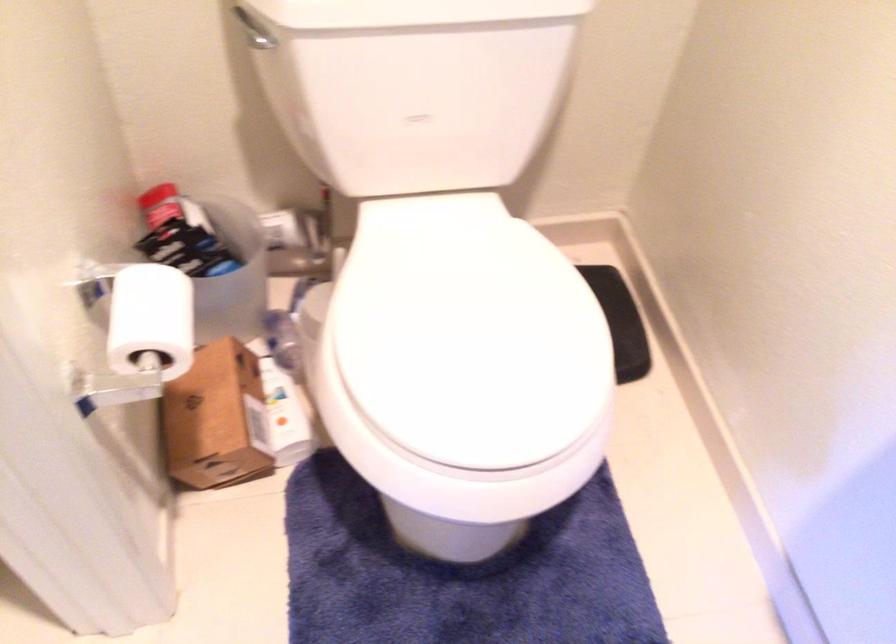
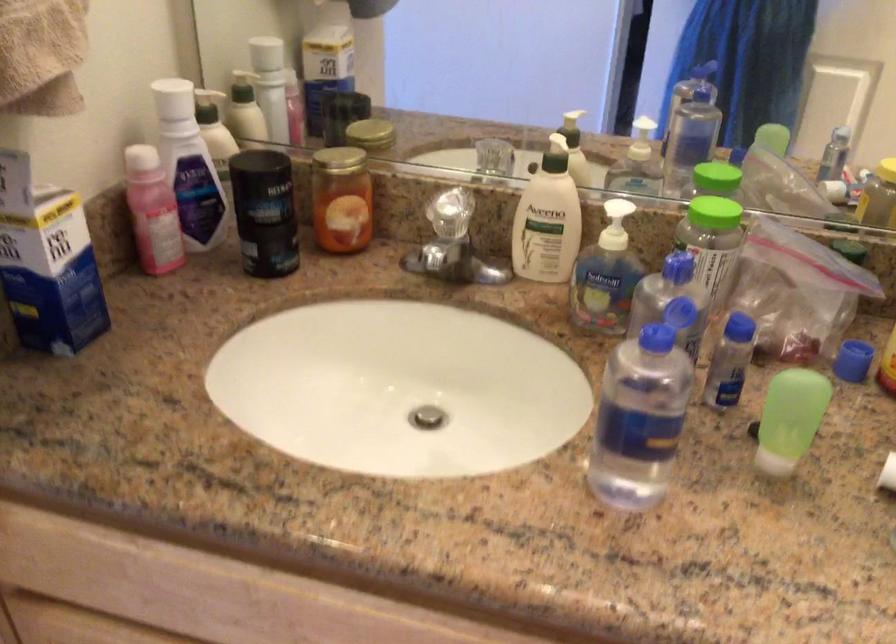
Consider the image. First-person continuous shooting, in which direction is the camera rotating?

The camera rotated toward left-up.